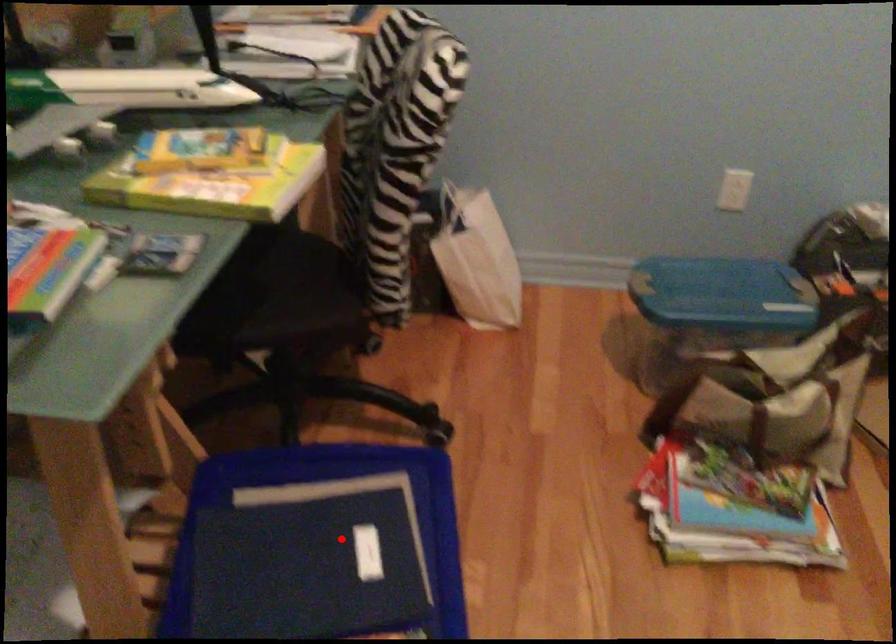
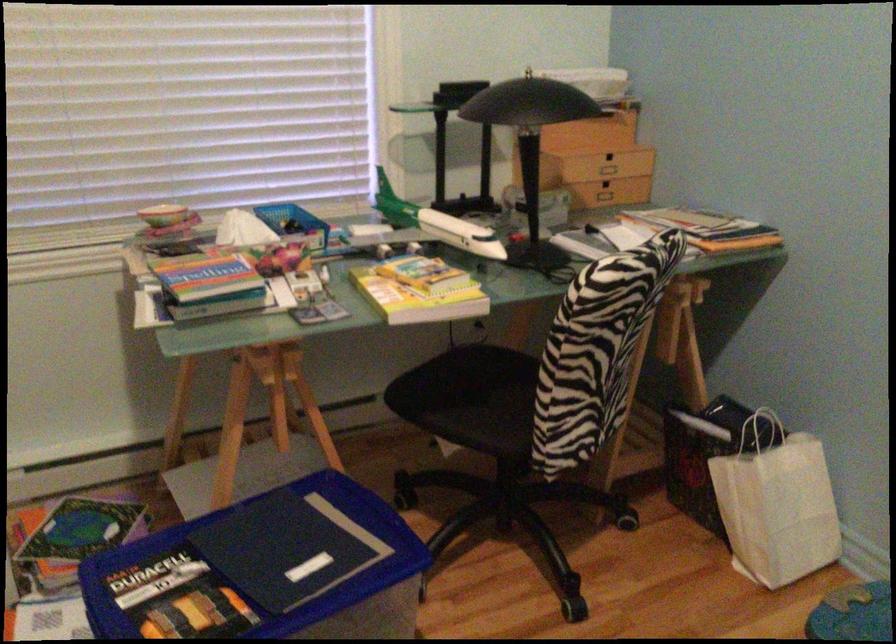
Question: I am providing you with two images of the same scene from different viewpoints. Given a red point in image1, look at the same physical point in image2. Is it:

Choices:
 (A) Closer to the viewpoint
 (B) Farther from the viewpoint

Answer: (B)